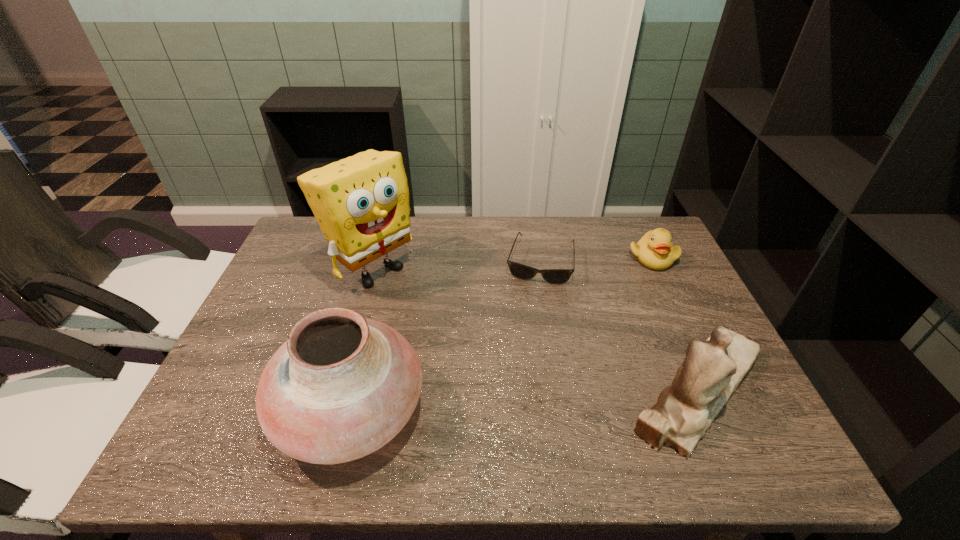
At what (x,y) coordinates should I click in order to perform the action: click on vacant region located 0.100m on the lenses of the sunglasses. Please return your answer as a coordinate pair (x, y). The width and height of the screenshot is (960, 540). Looking at the image, I should click on (531, 309).

Locate an element on the screen. The width and height of the screenshot is (960, 540). vacant space situated on the lenses of the sunglasses is located at coordinates (533, 299).

Identify the location of vacant space located on the lenses of the sunglasses. This screenshot has height=540, width=960. (527, 328).

You are a GUI agent. You are given a task and a screenshot of the screen. Output one action in this format:
    pyautogui.click(x=<x>, y=<y>)
    Task: Click on the vacant region located on the front-facing side of the duckling
    This screenshot has width=960, height=540.
    Given the screenshot: What is the action you would take?
    pyautogui.click(x=579, y=347)

The width and height of the screenshot is (960, 540). Identify the location of vacant position located 0.100m on the front-facing side of the duckling. (628, 287).

Where is `vacant area situated on the front-facing side of the duckling`? Image resolution: width=960 pixels, height=540 pixels. vacant area situated on the front-facing side of the duckling is located at coordinates (596, 326).

Locate an element on the screen. The height and width of the screenshot is (540, 960). sponge present at the far edge is located at coordinates (361, 203).

Locate an element on the screen. Image resolution: width=960 pixels, height=540 pixels. sunglasses present at the far edge is located at coordinates (553, 276).

I want to click on duckling located at the far edge, so click(x=654, y=250).

Where is `pottery present at the near edge`? pottery present at the near edge is located at coordinates (342, 386).